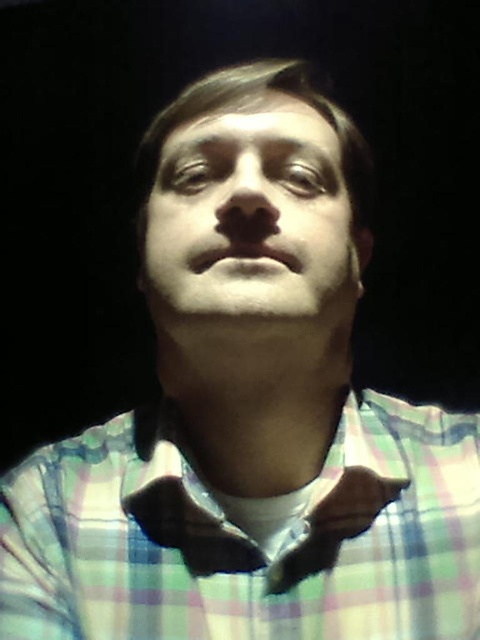
Question: Which point is farther to the camera?

Choices:
 (A) (477, 484)
 (B) (129, 509)

Answer: (A)

Question: Does checkered fabric shirt at center appear on the left side of brown leather bow tie at center?

Choices:
 (A) no
 (B) yes

Answer: (B)

Question: Considering the relative positions of checkered fabric shirt at center and brown leather bow tie at center in the image provided, where is checkered fabric shirt at center located with respect to brown leather bow tie at center?

Choices:
 (A) left
 (B) right

Answer: (A)

Question: Among these points, which one is farthest from the camera?

Choices:
 (A) (344, 481)
 (B) (428, 442)

Answer: (B)

Question: Can you confirm if checkered fabric shirt at center is positioned to the right of brown leather bow tie at center?

Choices:
 (A) yes
 (B) no

Answer: (B)

Question: Which object is farther from the camera taking this photo?

Choices:
 (A) brown leather bow tie at center
 (B) checkered fabric shirt at center

Answer: (A)